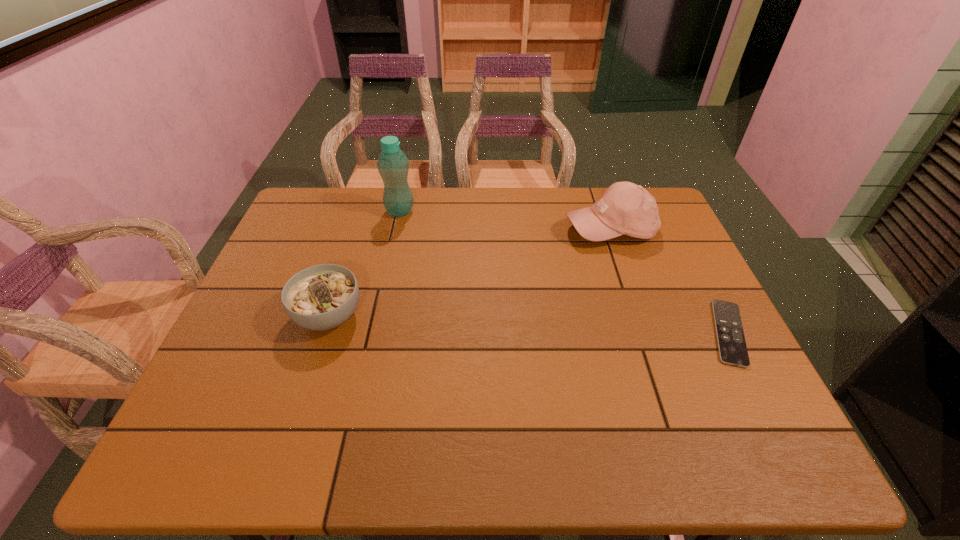
This screenshot has width=960, height=540. What are the coordinates of `free space that satisfies the following two spatial constraints: 1. on the back side of the second object from right to left; 2. on the right side of the second shortest object` in the screenshot? It's located at (357, 229).